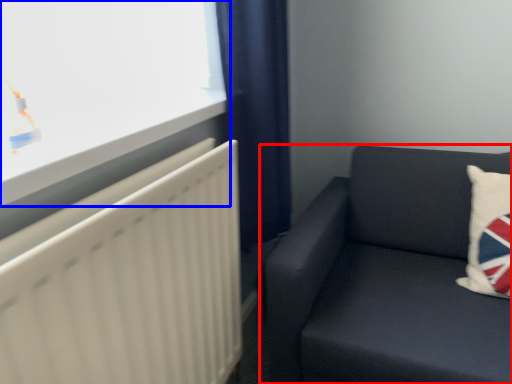
Question: Which object appears closest to the camera in this image, studio couch (highlighted by a red box) or window (highlighted by a blue box)?

Choices:
 (A) studio couch
 (B) window

Answer: (B)